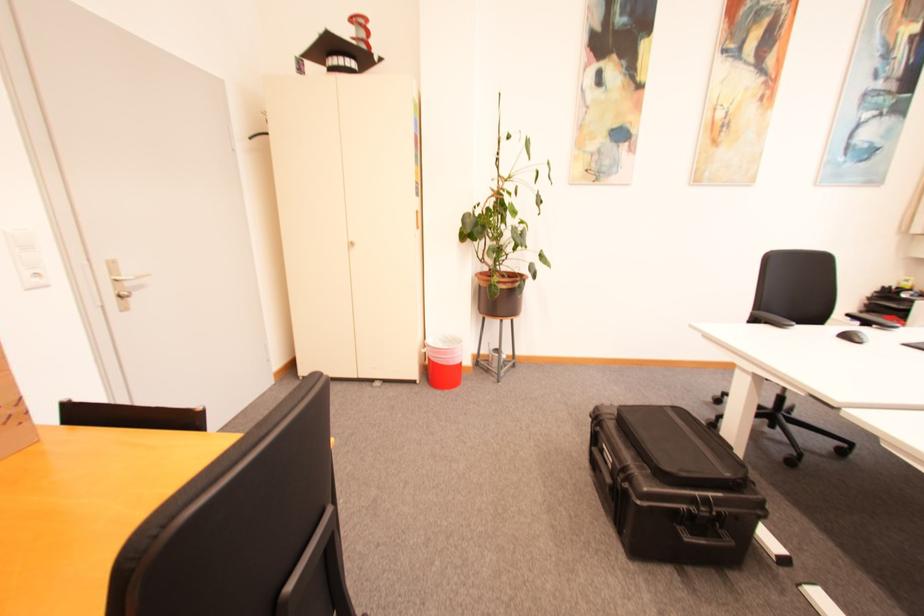
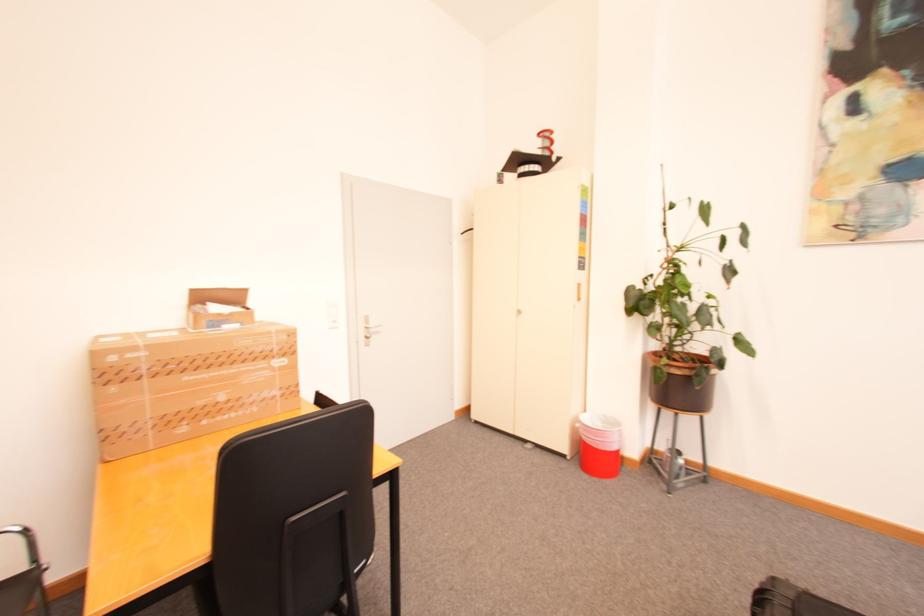
Question: Based on the continuous images, in which direction is the camera rotating? Reply with the corresponding letter.

Choices:
 (A) Left
 (B) Right
 (C) Up
 (D) Down

Answer: (A)